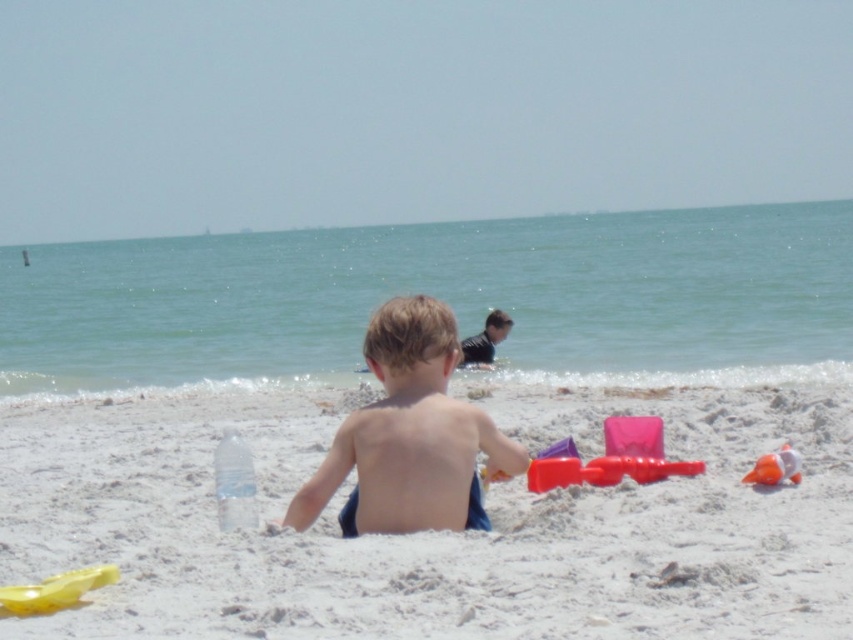
You are a photographer trying to capture a shot of the dark blue wetsuit at upper center and the orange rubber ball at lower right. Which object should you focus on first if you want to ensure both are in focus without moving the camera?

The dark blue wetsuit at upper center is taller than the orange rubber ball at lower right, so focusing on the dark blue wetsuit at upper center first will help ensure both are in focus since it is larger and closer to the camera.